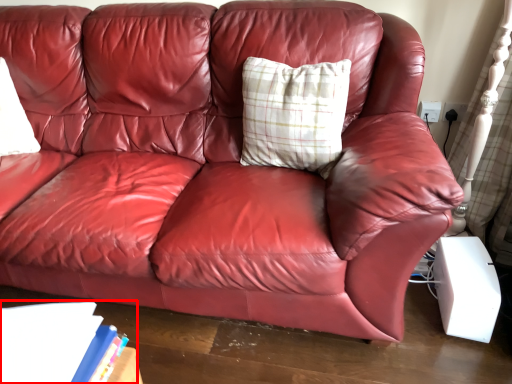
Question: Observing the image, what is the correct spatial positioning of book (annotated by the red box) in reference to pillow?

Choices:
 (A) left
 (B) right

Answer: (A)